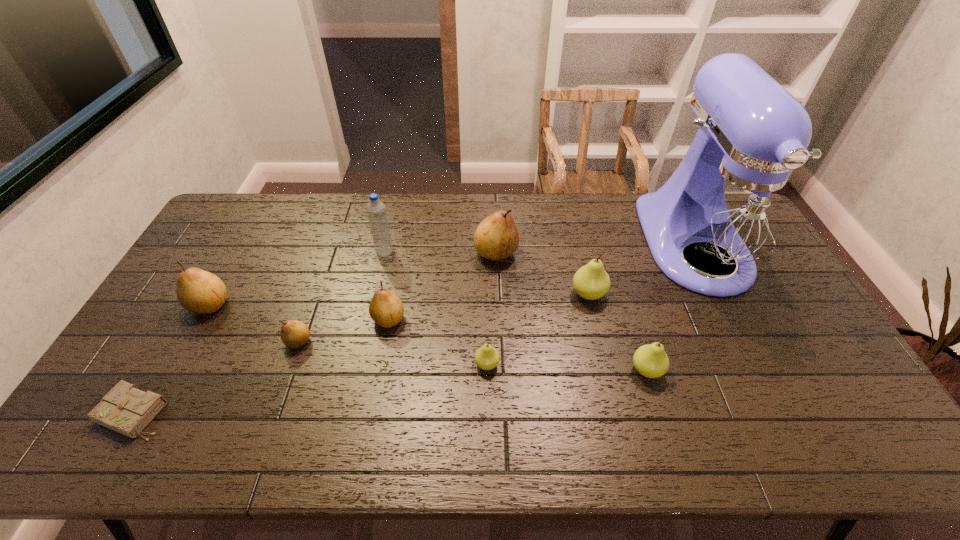
The width and height of the screenshot is (960, 540). Identify the location of vacant area that lies between the second biggest green pear and the leftmost brown pear. (428, 338).

Where is `vacant area that lies between the eighth object from left to right and the rightmost green pear`? vacant area that lies between the eighth object from left to right and the rightmost green pear is located at coordinates [617, 332].

Locate an element on the screen. The width and height of the screenshot is (960, 540). vacant space that's between the leftmost brown pear and the rightmost brown pear is located at coordinates (353, 279).

The height and width of the screenshot is (540, 960). What are the coordinates of `vacant space in between the sixth pear from left to right and the third biggest brown pear` in the screenshot? It's located at (489, 307).

The image size is (960, 540). I want to click on free area in between the eighth object from right to left and the rightmost pear, so click(472, 356).

Identify the location of vacant region between the nearest object and the tallest pear. [315, 333].

Where is `free space between the tallest pear and the smallest green pear`? The image size is (960, 540). free space between the tallest pear and the smallest green pear is located at coordinates (492, 309).

Locate an element on the screen. The width and height of the screenshot is (960, 540). free space that is in between the farthest brown pear and the blue water bottle is located at coordinates (441, 252).

You are a GUI agent. You are given a task and a screenshot of the screen. Output one action in this format:
    pyautogui.click(x=<x>, y=<y>)
    Task: Click on the object that ranks as the eighth closest to the leftmost pear
    Image resolution: width=960 pixels, height=540 pixels.
    Given the screenshot: What is the action you would take?
    pyautogui.click(x=650, y=360)

What are the coordinates of `object that is the closest to the second object from right to left` in the screenshot? It's located at (591, 282).